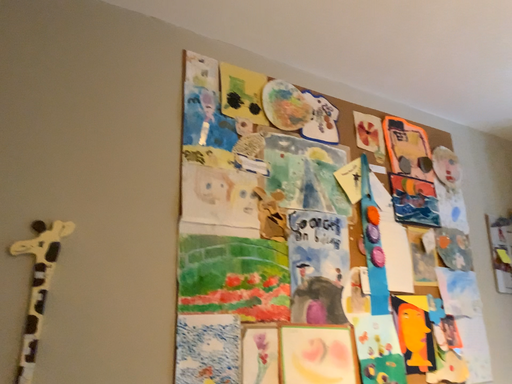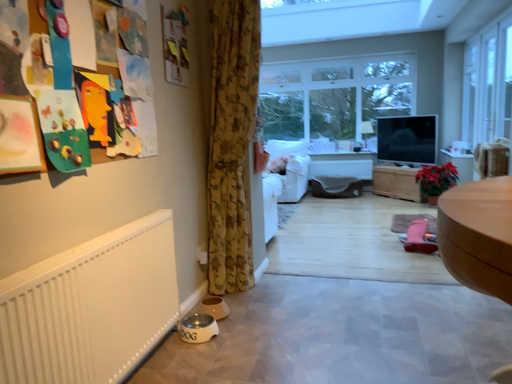
Question: Which way did the camera rotate in the video?

Choices:
 (A) rotated left
 (B) rotated right

Answer: (B)